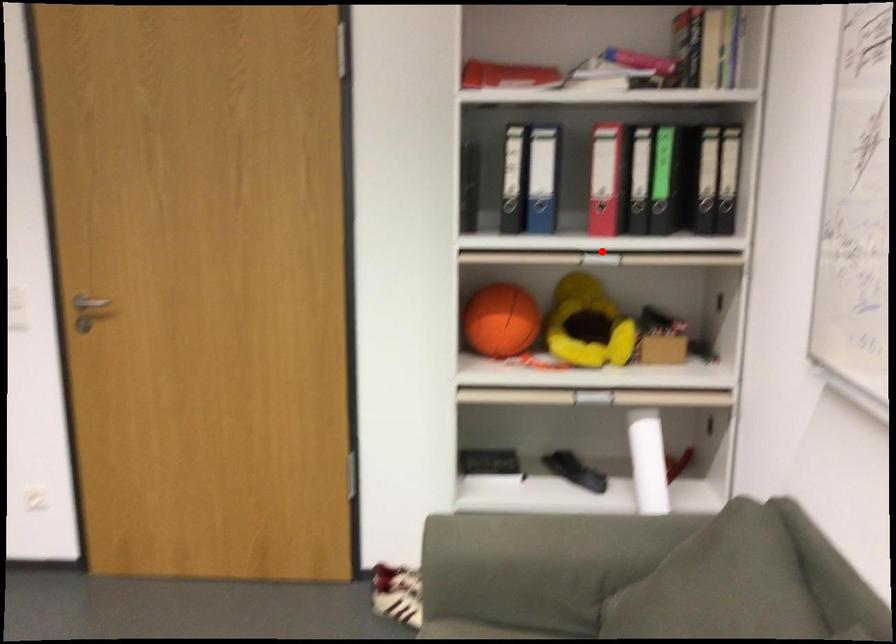
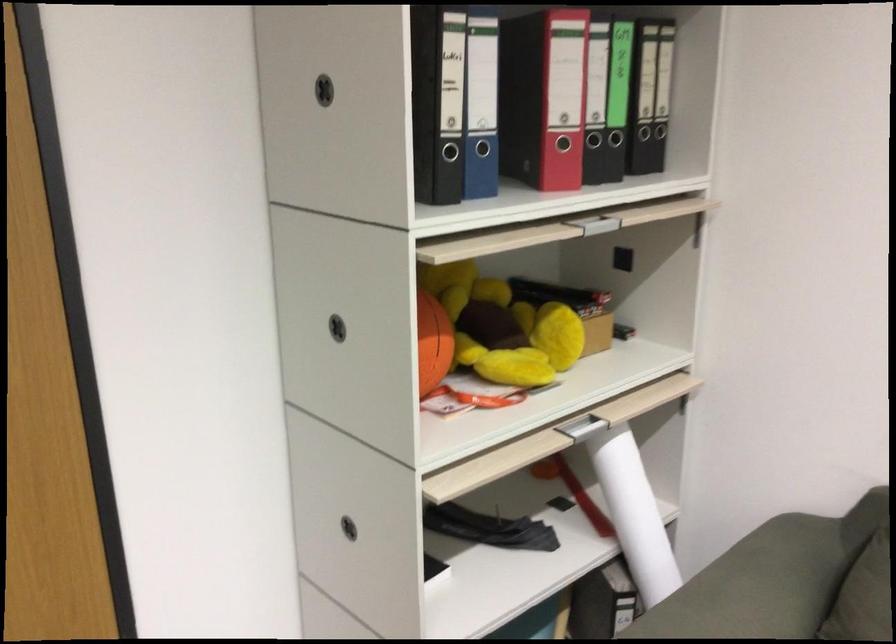
Question: I am providing you with two images of the same scene from different viewpoints. A red point is shown in image1. For the corresponding object point in image2, is it positioned nearer or farther from the camera?

Choices:
 (A) Nearer
 (B) Farther

Answer: (A)